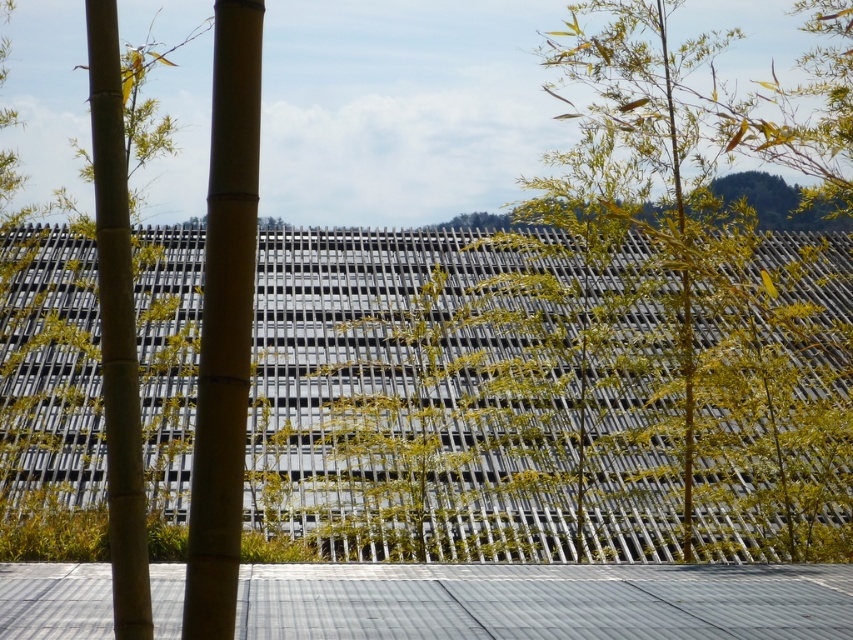
Is green bamboo forest at center smaller than green bamboo at left?

Actually, green bamboo forest at center might be larger than green bamboo at left.

Does green bamboo forest at center come in front of green bamboo at left?

No, green bamboo forest at center is further to the viewer.

This screenshot has height=640, width=853. Find the location of `green bamboo forest at center`. green bamboo forest at center is located at coordinates click(x=548, y=397).

From the picture: Does smooth bamboo pole at center have a smaller size compared to green bamboo at left?

Yes, smooth bamboo pole at center is smaller than green bamboo at left.

Does smooth bamboo pole at center appear under green bamboo at left?

Actually, smooth bamboo pole at center is above green bamboo at left.

Which is in front, point (222, 234) or point (138, 524)?

Positioned in front is point (222, 234).

Where is `smooth bamboo pole at center`? smooth bamboo pole at center is located at coordinates (224, 324).

Based on the photo, is green bamboo forest at center wider than smooth bamboo pole at center?

Yes, green bamboo forest at center is wider than smooth bamboo pole at center.

Does point (688, 337) come in front of point (213, 385)?

No.

This screenshot has width=853, height=640. What do you see at coordinates (548, 397) in the screenshot? I see `green bamboo forest at center` at bounding box center [548, 397].

Image resolution: width=853 pixels, height=640 pixels. In order to click on green bamboo forest at center in this screenshot , I will do `click(548, 397)`.